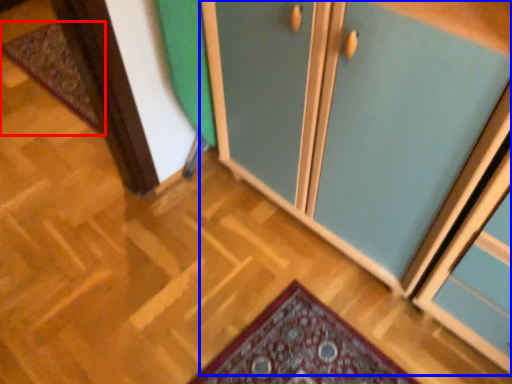
Question: Which object appears closest to the camera in this image, mat (highlighted by a red box) or cupboard (highlighted by a blue box)?

Choices:
 (A) mat
 (B) cupboard

Answer: (B)